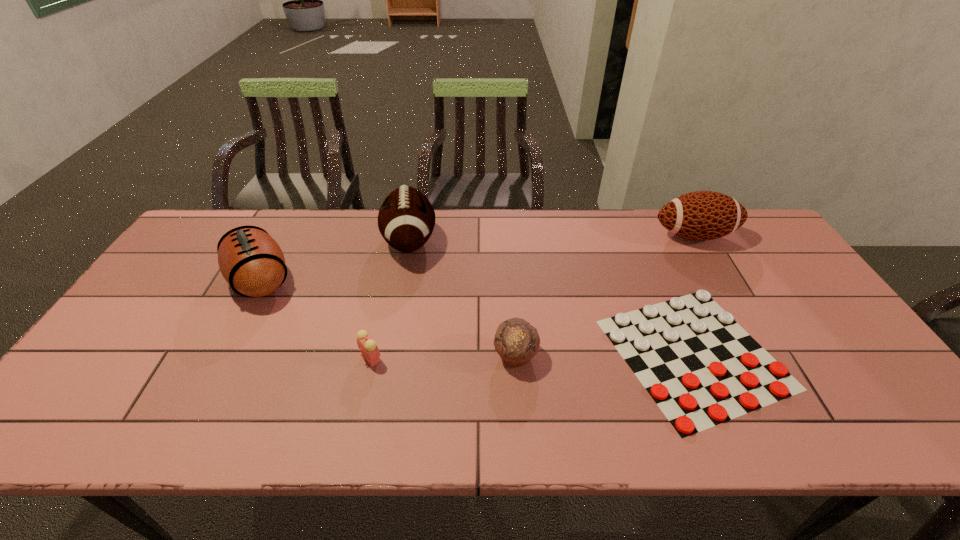
Select which object is the closest to the leftmost object. Please provide its 2D coordinates. Your answer should be formatted as a tuple, i.e. [(x, y)], where the tuple contains the x and y coordinates of a point satisfying the conditions above.

[(406, 219)]

Identify the location of object that is the fifth closest to the second football (American) from left to right. The height and width of the screenshot is (540, 960). (702, 215).

Point out which football (American) is positioned as the nearest to the alarm clock. Please provide its 2D coordinates. Your answer should be formatted as a tuple, i.e. [(x, y)], where the tuple contains the x and y coordinates of a point satisfying the conditions above.

[(251, 261)]

Identify which football (American) is the third closest to the checkerboard. Please provide its 2D coordinates. Your answer should be formatted as a tuple, i.e. [(x, y)], where the tuple contains the x and y coordinates of a point satisfying the conditions above.

[(251, 261)]

This screenshot has width=960, height=540. Find the location of `free region that satisfies the following two spatial constraints: 1. on the back side of the leftmost object; 2. on the left side of the rightmost football (American)`. free region that satisfies the following two spatial constraints: 1. on the back side of the leftmost object; 2. on the left side of the rightmost football (American) is located at coordinates (284, 235).

Where is `free space that satisfies the following two spatial constraints: 1. on the back side of the fourth tallest object; 2. on the right side of the checkerboard`? This screenshot has height=540, width=960. free space that satisfies the following two spatial constraints: 1. on the back side of the fourth tallest object; 2. on the right side of the checkerboard is located at coordinates (516, 353).

Where is `free region that satisfies the following two spatial constraints: 1. on the back side of the leftmost object; 2. on the left side of the second football (American) from right to left`? This screenshot has height=540, width=960. free region that satisfies the following two spatial constraints: 1. on the back side of the leftmost object; 2. on the left side of the second football (American) from right to left is located at coordinates (281, 241).